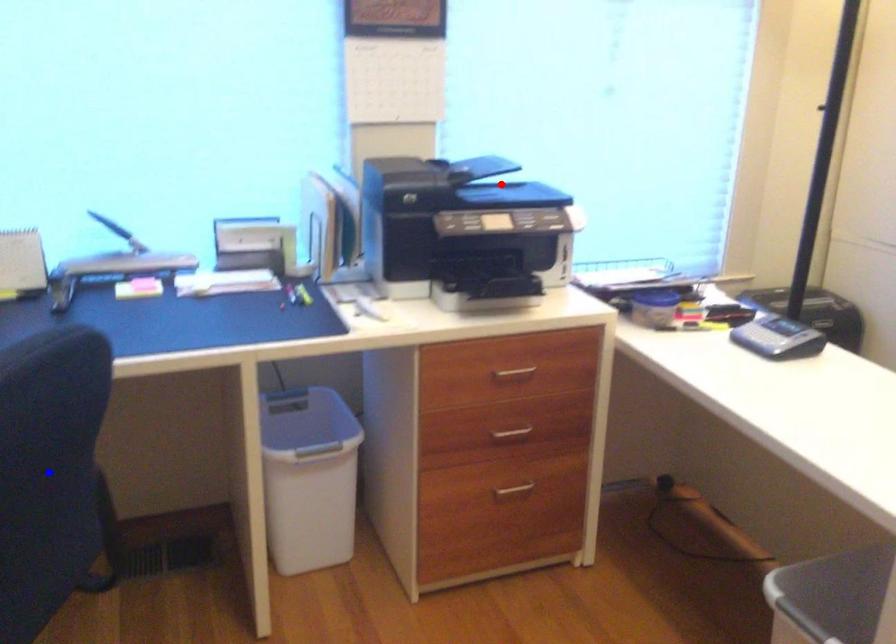
Question: In the image, two points are highlighted. Which point is nearer to the camera? Reply with the corresponding letter.

Choices:
 (A) blue point
 (B) red point

Answer: (A)